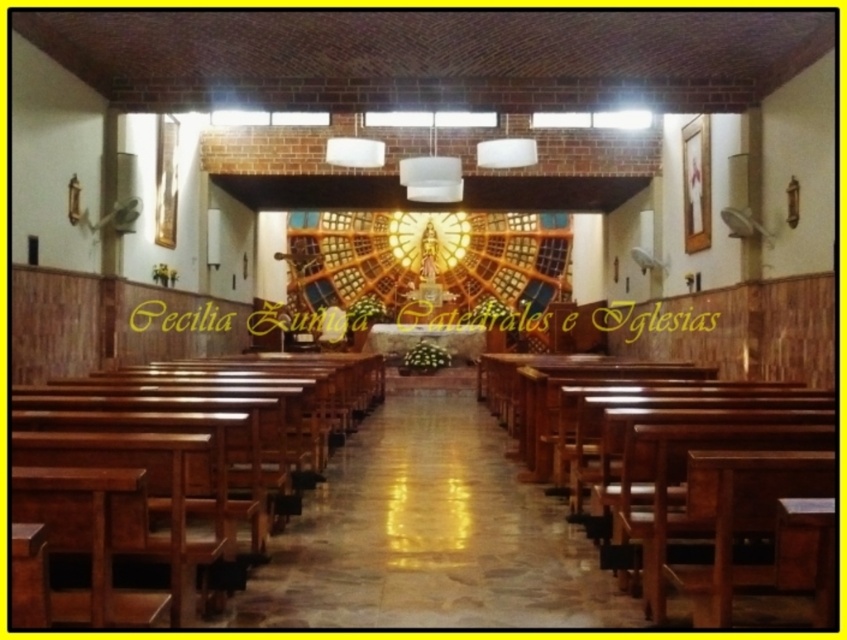
You are standing at the entrance of the church and want to sit on the wooden church bench at center. According to the coordinates provided, in which direction should you walk to reach it?

The wooden church bench at center is located at coordinates point (x=156, y=481). Since the entrance is at the start of the aisle, you should walk forward towards the front of the church to reach the wooden church bench at center.

You are attending a church service and need to choose a bench to sit on. Both the wooden church bench at center and the polished wood church bench at center are available. Which bench is smaller in size?

The wooden church bench at center is smaller than the polished wood church bench at center, so you should choose the wooden church bench at center if you prefer a smaller seating option.